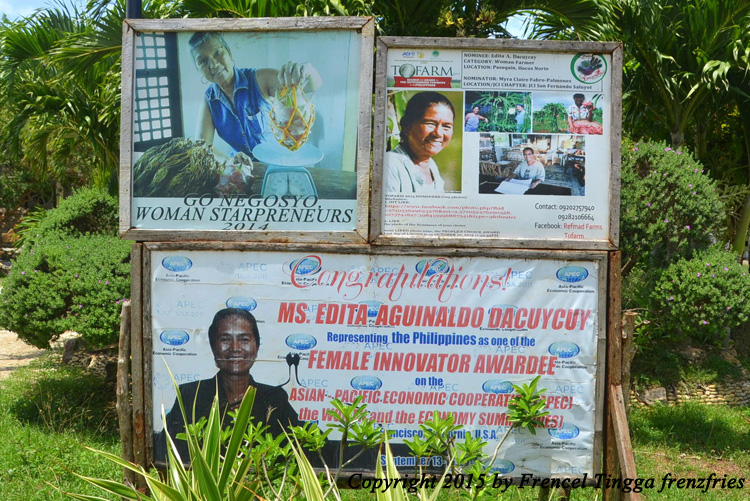
You are a GUI agent. You are given a task and a screenshot of the screen. Output one action in this format:
    pyautogui.click(x=<x>, y=<y>)
    Task: Click on the plant
    
    Given the screenshot: What is the action you would take?
    pyautogui.click(x=200, y=465), pyautogui.click(x=400, y=492), pyautogui.click(x=523, y=423)